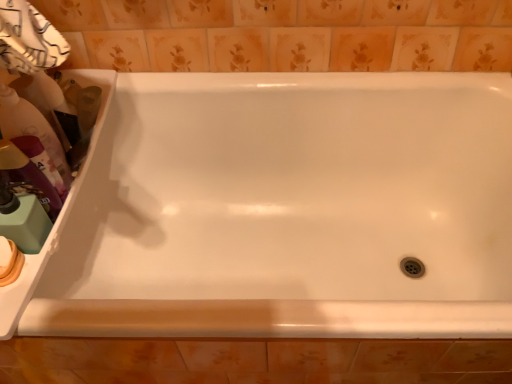
Image resolution: width=512 pixels, height=384 pixels. What are the coordinates of `vacant area on the back side of matte plastic bottle at left, positioned as the 4th cleaning product in bottom-to-top order` in the screenshot? It's located at (96, 91).